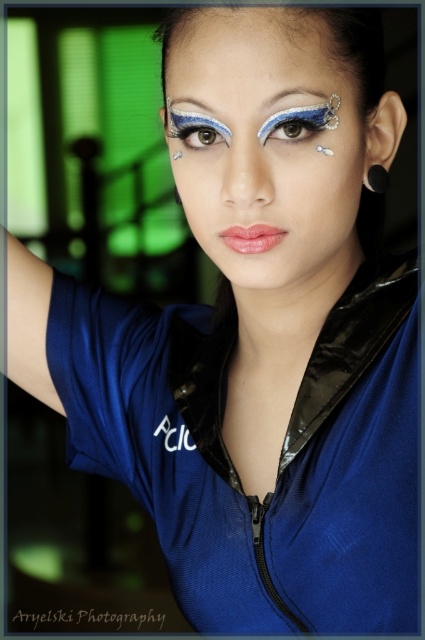
You are a makeup artist analyzing the portrait. The client wants to know if their satin black eyebrow at upper center is positioned higher than their silver metallic earring at upper right. Based on the image, how would you respond?

The satin black eyebrow at upper center is above the silver metallic earring at upper right, so yes, it is positioned higher.

You are a makeup artist preparing to adjust the proportions of the makeup on the portrait subject. Based on the image, which object is shorter in height between the satin black eyebrow at upper center and the silver metallic earring at upper right?

The satin black eyebrow at upper center is not as tall as the silver metallic earring at upper right, so the satin black eyebrow at upper center is shorter in height.

You are a makeup artist preparing to apply eyeliner on a client who has both shiny blue eye makeup at center and blue glitter eye at center. Which of these should you avoid overlapping the eyeliner with to maintain their distinct appearance?

The shiny blue eye makeup at center is below the blue glitter eye at center, so you should avoid overlapping the eyeliner with the shiny blue eye makeup at center to keep it distinct from the blue glitter eye at center.